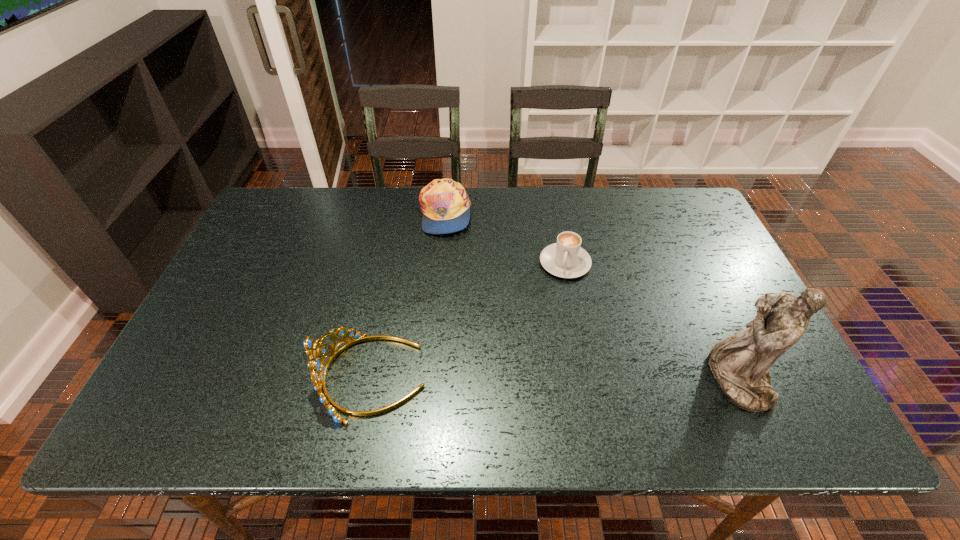
Identify the location of free region that satisfies the following two spatial constraints: 1. on the front side of the rightmost object; 2. on the front-facing side of the farthest object. (430, 379).

Where is `free space that satisfies the following two spatial constraints: 1. on the front side of the figurine; 2. on the front-facing side of the third nearest object`? free space that satisfies the following two spatial constraints: 1. on the front side of the figurine; 2. on the front-facing side of the third nearest object is located at coordinates (588, 379).

Image resolution: width=960 pixels, height=540 pixels. I want to click on vacant space that satisfies the following two spatial constraints: 1. on the front side of the farthest object; 2. on the front-facing side of the figurine, so click(x=430, y=379).